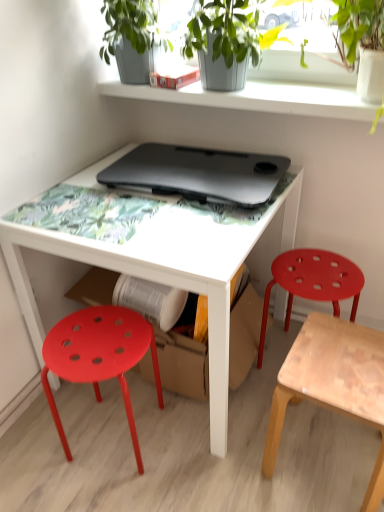
Identify the location of empty space that is ontop of matte plastic stool at right, the 1th stool positioned from the right (from a real-world perspective). The height and width of the screenshot is (512, 384). (318, 275).